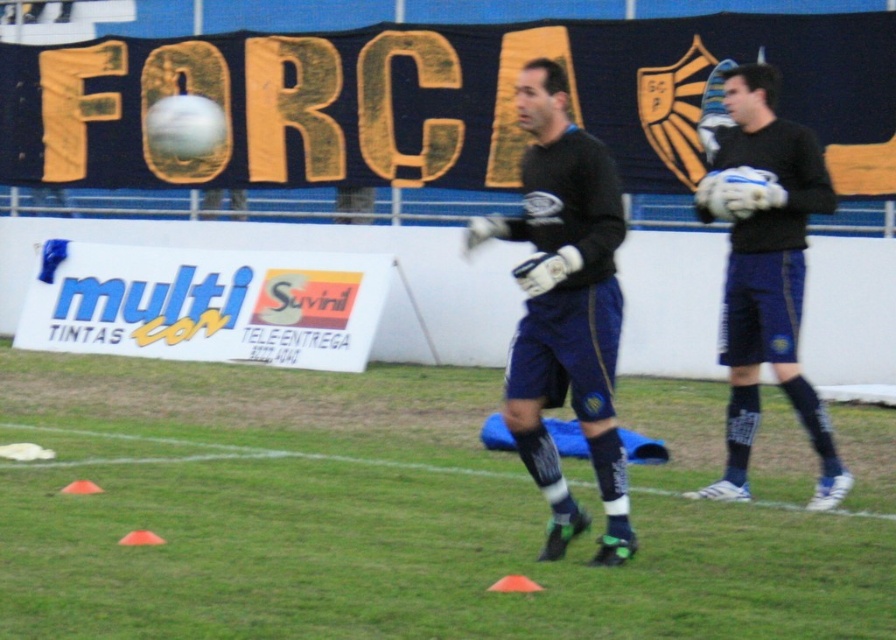
You are a drone operator tasked with capturing aerial footage of the soccer training session. The green grass at center is at coordinates point 0.803, 0.440. To ensure the best shot, you need to position the drone directly above this point. What is the exact coordinate where you should place the drone?

The exact coordinate to position the drone directly above the green grass at center is point (393, 513).

You are a soccer coach observing a training session. You notice the dark blue jersey at center and the matte black gloves at right. Which object appears smaller in size?

The dark blue jersey at center appears smaller in size compared to the matte black gloves at right according to the description.

From the picture: Based on the coordinates provided, what is located at point (393, 513) in the soccer training session image?

The point (393, 513) indicates green grass at center.